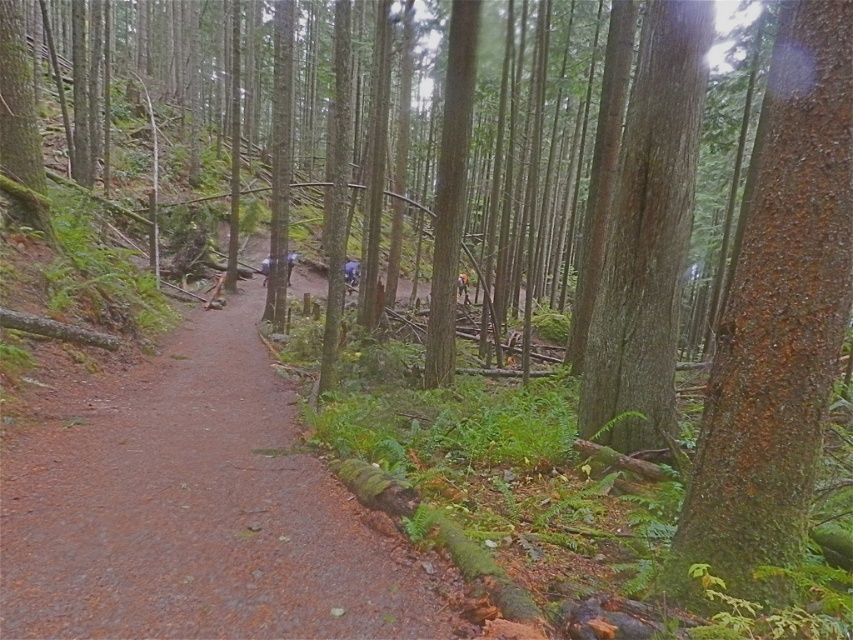
Question: Among these points, which one is nearest to the camera?

Choices:
 (A) (817, 29)
 (B) (664, 113)
 (C) (102, 484)

Answer: (A)

Question: Based on their relative distances, which object is farther from the brown dirt path at center?

Choices:
 (A) green rough bark tree at right
 (B) smooth brown tree trunk at center-right

Answer: (B)

Question: Considering the real-world distances, which object is closest to the smooth brown tree trunk at center-right?

Choices:
 (A) brown dirt path at center
 (B) green rough bark tree at right

Answer: (B)

Question: Can you confirm if brown dirt path at center is bigger than green rough bark tree at right?

Choices:
 (A) no
 (B) yes

Answer: (A)

Question: Can you confirm if green rough bark tree at right is thinner than smooth brown tree trunk at center-right?

Choices:
 (A) no
 (B) yes

Answer: (A)

Question: Does brown dirt path at center come behind green rough bark tree at right?

Choices:
 (A) no
 (B) yes

Answer: (B)